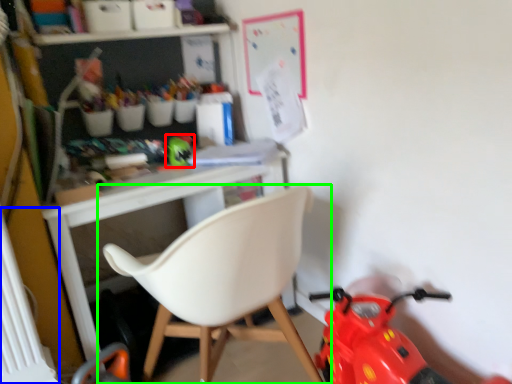
Question: Which object is the farthest from toy (highlighted by a red box)? Choose among these: radiator (highlighted by a blue box) or chair (highlighted by a green box).

Choices:
 (A) radiator
 (B) chair

Answer: (A)